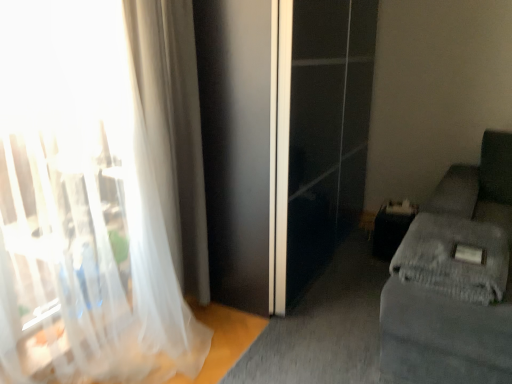
Question: Relative to gray textured blanket at lower right, is white sheer curtain at left, positioned as the 2th curtain in back-to-front order, in front or behind?

Choices:
 (A) behind
 (B) front

Answer: (B)

Question: Is point (45, 198) closer or farther from the camera than point (497, 299)?

Choices:
 (A) closer
 (B) farther

Answer: (B)

Question: Estimate the real-world distances between objects in this image. Which object is farther from the gray fabric couch at right?

Choices:
 (A) translucent fabric curtain at left, arranged as the 2th curtain when viewed from the front
 (B) white sheer curtain at left, positioned as the 2th curtain in back-to-front order
 (C) gray textured blanket at lower right

Answer: (B)

Question: Which object is positioned closest to the white sheer curtain at left, arranged as the 1th curtain when viewed from the front?

Choices:
 (A) translucent fabric curtain at left, which ranks as the 1th curtain in back-to-front order
 (B) gray textured blanket at lower right
 (C) gray fabric couch at right

Answer: (A)